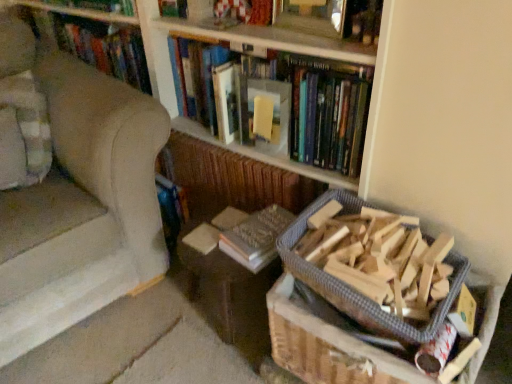
Where is `vacant space to the left of metallic silver picture frame at upper center`? The height and width of the screenshot is (384, 512). vacant space to the left of metallic silver picture frame at upper center is located at coordinates (250, 36).